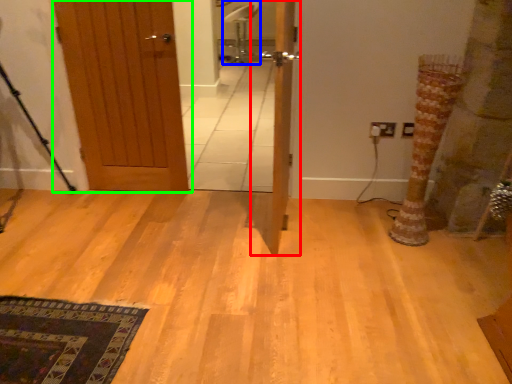
Question: Estimate the real-world distances between objects in this image. Which object is farther from door (highlighted by a red box), chair (highlighted by a blue box) or door (highlighted by a green box)?

Choices:
 (A) chair
 (B) door

Answer: (A)